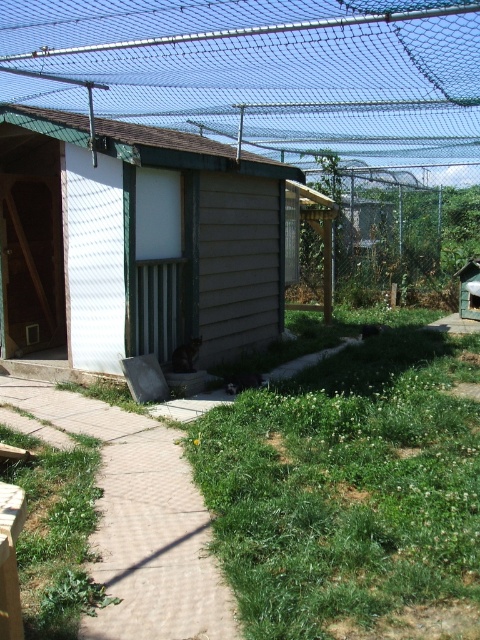
Which is more to the right, green mesh fence at upper center or brown brick path at lower left?

green mesh fence at upper center is more to the right.

Which is in front, point (322, 74) or point (74, 429)?

Positioned in front is point (74, 429).

Is point (363, 16) behind point (199, 602)?

Yes, point (363, 16) is behind point (199, 602).

Locate an element on the screen. green mesh fence at upper center is located at coordinates (268, 74).

Does green grass at lower right come in front of green mesh fence at upper center?

That is True.

Which is more to the left, green grass at lower right or green mesh fence at upper center?

From the viewer's perspective, green grass at lower right appears more on the left side.

The width and height of the screenshot is (480, 640). Find the location of `green grass at lower right`. green grass at lower right is located at coordinates (348, 486).

Can you confirm if green mesh fence at upper center is shorter than brown wood cabin at center?

Yes, green mesh fence at upper center is shorter than brown wood cabin at center.

Who is positioned more to the left, green mesh fence at upper center or brown wood cabin at center?

brown wood cabin at center

Which is behind, point (344, 84) or point (176, 147)?

The point (344, 84) is behind.

The width and height of the screenshot is (480, 640). I want to click on green mesh fence at upper center, so click(x=268, y=74).